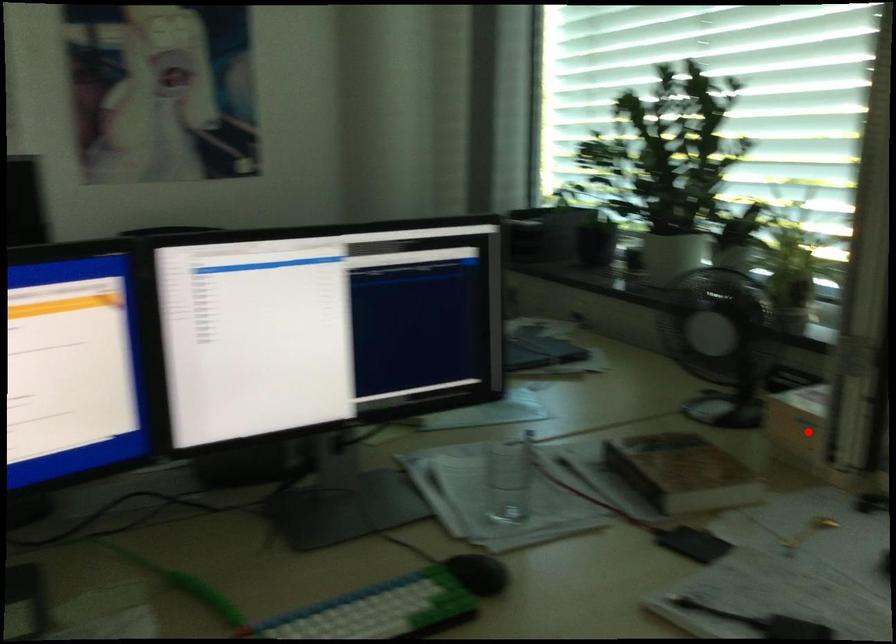
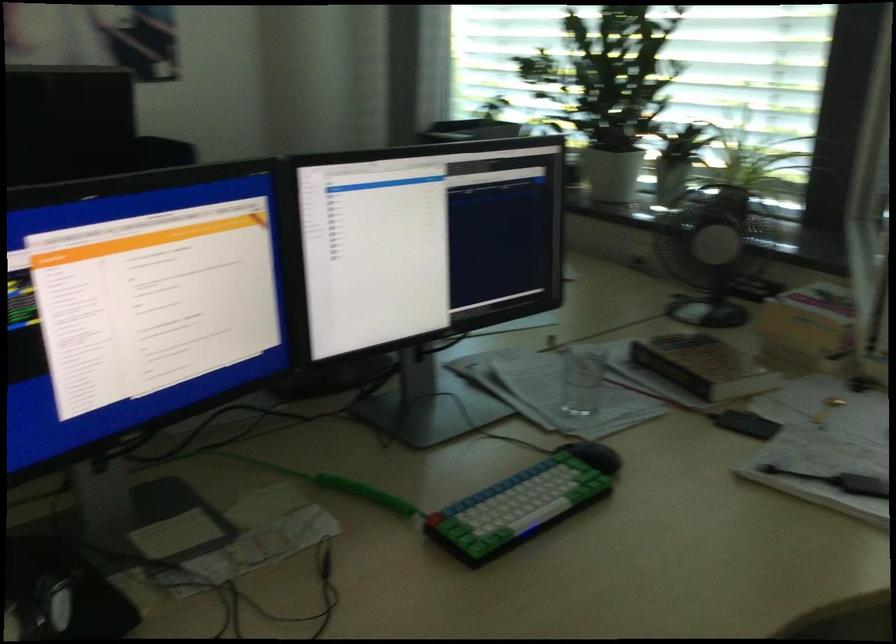
Question: I am providing you with two images of the same scene from different viewpoints. In image1, a red point is highlighted. Considering the same 3D point in image2, which of the following is correct?

Choices:
 (A) It is closer
 (B) It is farther

Answer: (B)